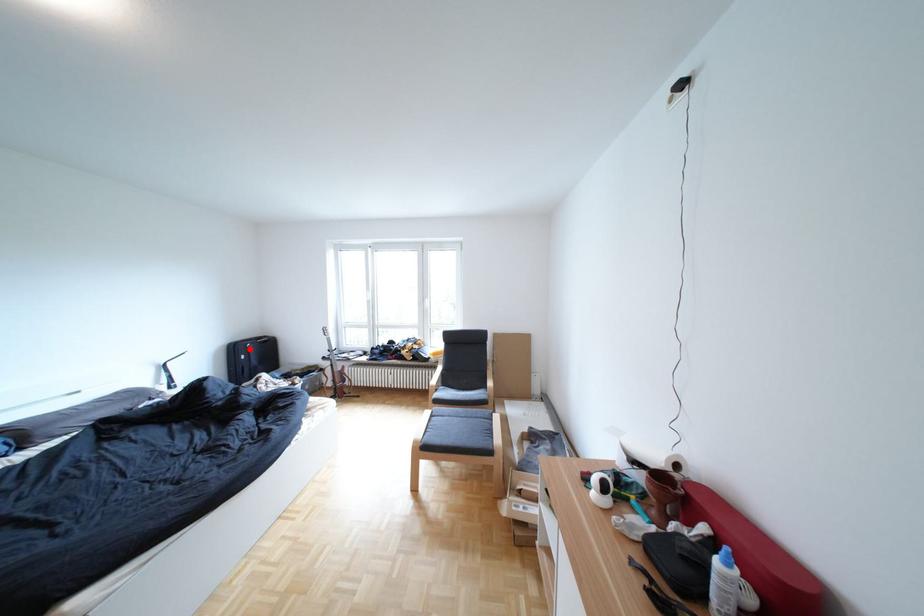
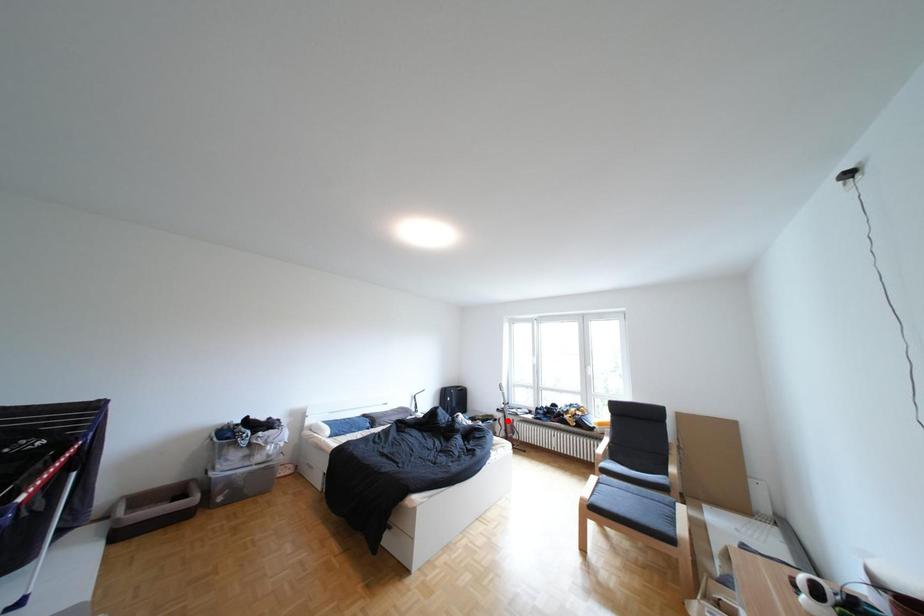
Consider the image. I am providing you with two images of the same scene from different viewpoints. A red point is marked on the first image and another point is marked on the second image. Are the points marked in image1 and image2 representing the same 3D position?

No